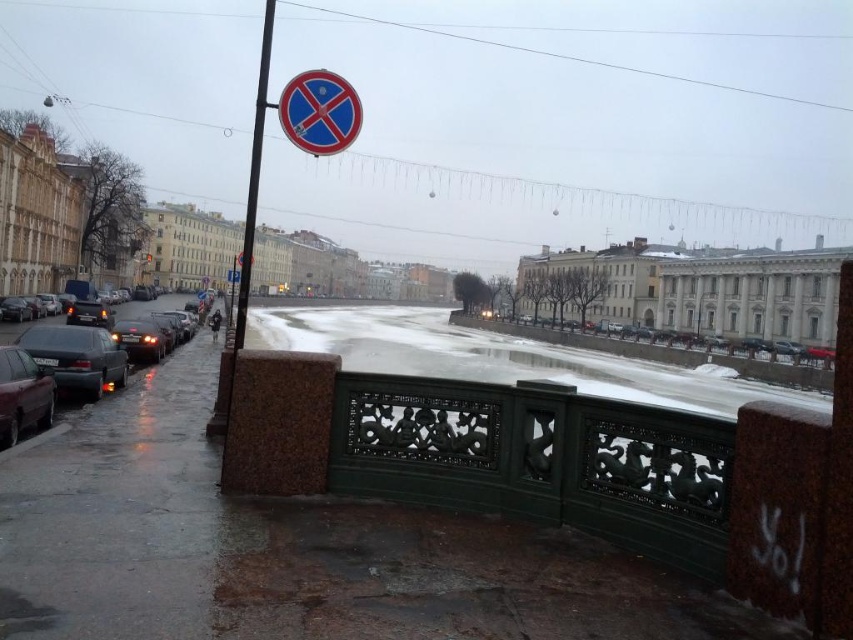
Question: Among these points, which one is farthest from the camera?

Choices:
 (A) (21, 403)
 (B) (258, 106)
 (C) (27, 426)

Answer: (C)

Question: Is blue glossy circle at upper center thinner than polished metal pole at upper left?

Choices:
 (A) yes
 (B) no

Answer: (A)

Question: Which point is closer to the camera taking this photo?

Choices:
 (A) (242, 323)
 (B) (36, 403)

Answer: (A)

Question: Does matte black car at left appear on the right side of blue glossy circle at upper center?

Choices:
 (A) yes
 (B) no

Answer: (B)

Question: Is blue glossy circle at upper center to the right of shiny black sedan at left from the viewer's perspective?

Choices:
 (A) no
 (B) yes

Answer: (B)

Question: Considering the real-world distances, which object is closest to the polished metal pole at upper left?

Choices:
 (A) blue glossy circle at upper center
 (B) matte black car at left
 (C) shiny black sedan at left

Answer: (C)